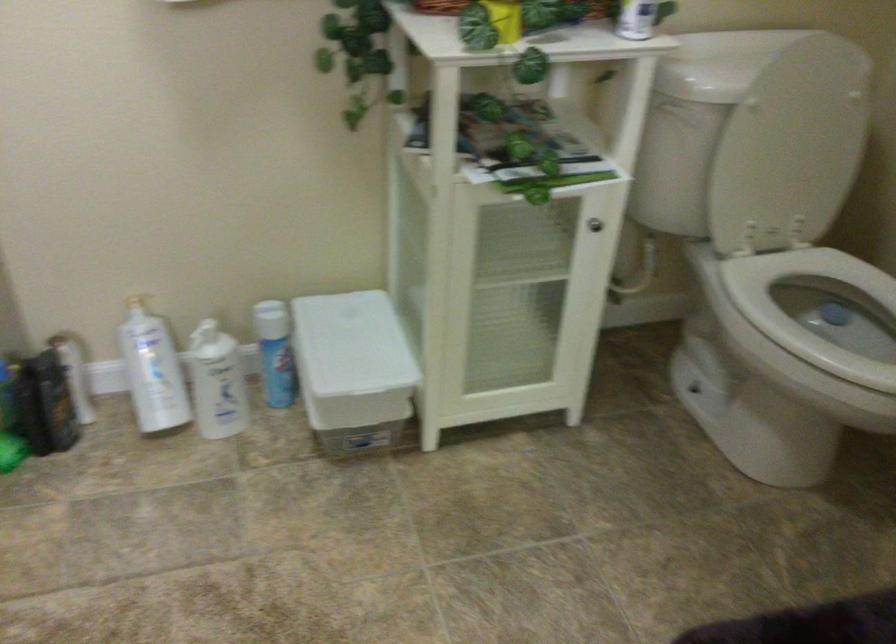
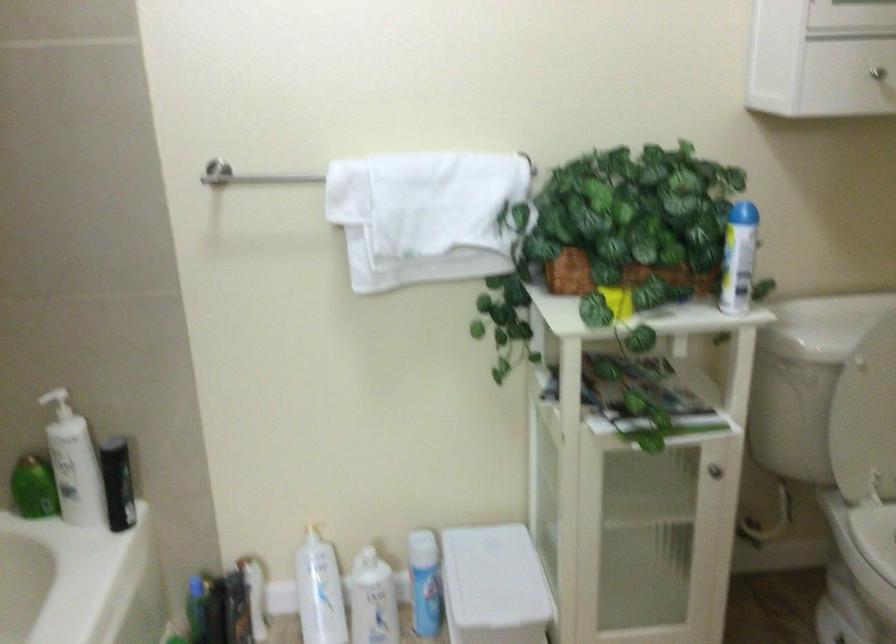
Where in the second image is the point corresponding to point 133,296 from the first image?

(306, 523)